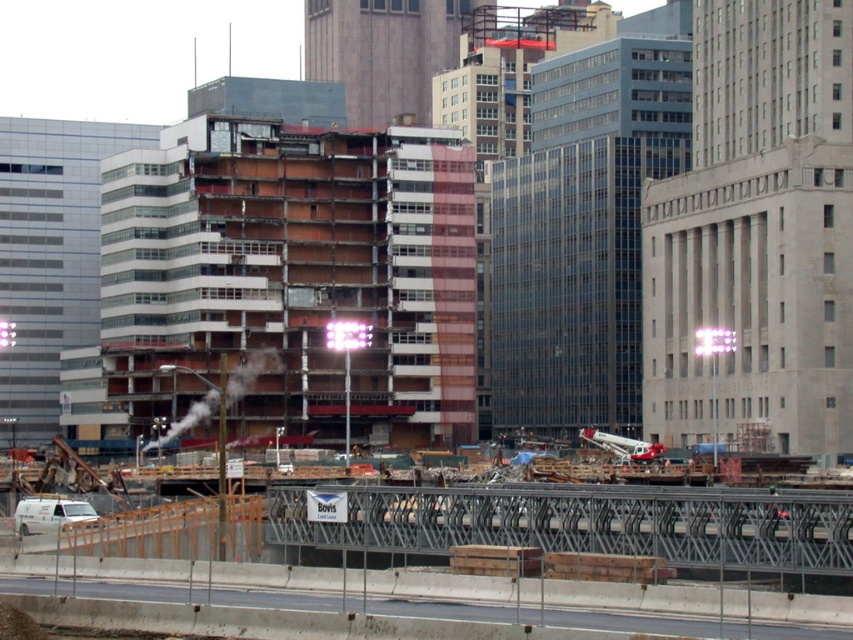
Who is higher up, exposed concrete building at center or metal/wooden fencing at lower center?

Positioned higher is exposed concrete building at center.

Is exposed concrete building at center shorter than metal/wooden fencing at lower center?

No.

Is point (350, 440) farther from camera compared to point (117, 561)?

That is True.

Where is `exposed concrete building at center`? The image size is (853, 640). exposed concrete building at center is located at coordinates (297, 273).